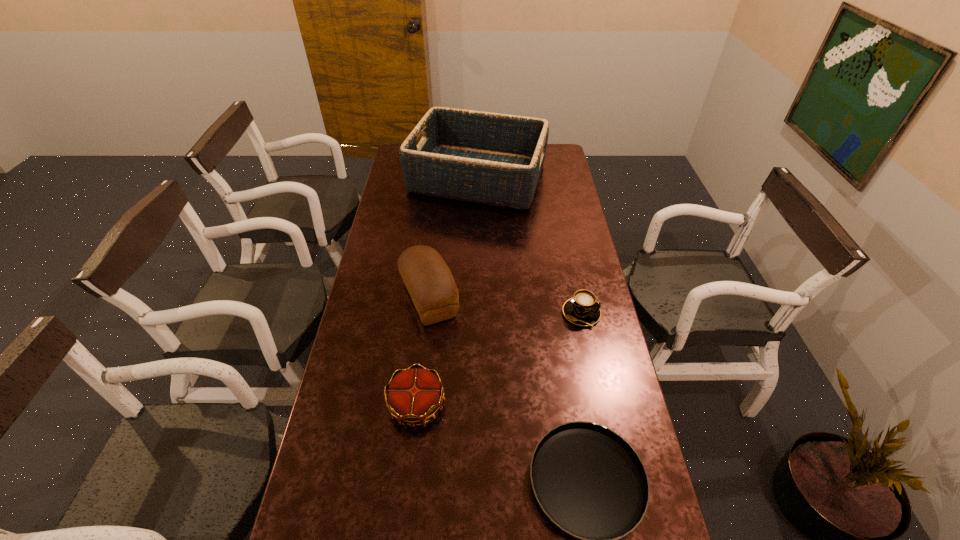
At what (x,y) coordinates should I click in order to perform the action: click on basket. Please return your answer as a coordinate pair (x, y). Looking at the image, I should click on (496, 159).

This screenshot has height=540, width=960. I want to click on the tallest object, so click(496, 159).

Find the location of a particular element. bread is located at coordinates (429, 282).

Find the location of a particular element. The image size is (960, 540). crown is located at coordinates (414, 395).

At what (x,y) coordinates should I click in order to perform the action: click on cappuccino. Please return your answer as a coordinate pair (x, y). Looking at the image, I should click on (582, 309).

You are a GUI agent. You are given a task and a screenshot of the screen. Output one action in this format:
    pyautogui.click(x=<x>, y=<y>)
    Task: Click on the vacant space positioned on the right of the tallest object
    Image resolution: width=960 pixels, height=540 pixels.
    Given the screenshot: What is the action you would take?
    pyautogui.click(x=558, y=177)

Image resolution: width=960 pixels, height=540 pixels. In order to click on free space located 0.080m on the right of the bread in this screenshot , I will do `click(483, 299)`.

The height and width of the screenshot is (540, 960). Find the location of `vacant area situated 0.270m on the back of the crown`. vacant area situated 0.270m on the back of the crown is located at coordinates (427, 310).

This screenshot has height=540, width=960. In order to click on free location located 0.390m on the left of the cappuccino in this screenshot , I will do `click(447, 313)`.

This screenshot has width=960, height=540. Find the location of `object located in the far edge section of the desktop`. object located in the far edge section of the desktop is located at coordinates (496, 159).